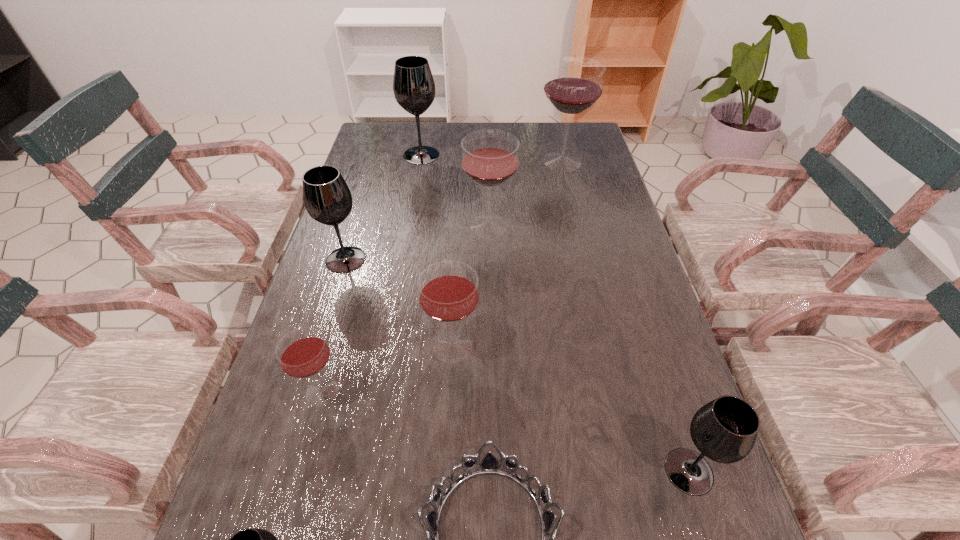
Locate which gray wineglass is the closest to the third farthest red wineglass. Please provide its 2D coordinates. Your answer should be formatted as a tuple, i.e. [(x, y)], where the tuple contains the x and y coordinates of a point satisfying the conditions above.

[(327, 198)]

What are the coordinates of `free spot that satisfies the following two spatial constraints: 1. on the front side of the fourth farthest wineglass; 2. on the right side of the rightmost gray wineglass` in the screenshot? It's located at (281, 471).

Where is `free space that satisfies the following two spatial constraints: 1. on the front side of the fourth object from left to right; 2. on the left side of the second nearest wineglass`? free space that satisfies the following two spatial constraints: 1. on the front side of the fourth object from left to right; 2. on the left side of the second nearest wineglass is located at coordinates (366, 471).